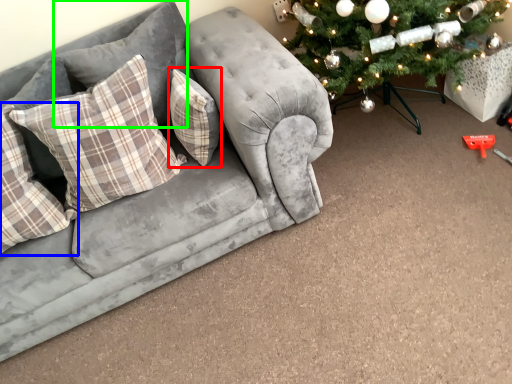
Question: Based on their relative distances, which object is farther from pillow (highlighted by a red box)? Choose from pillow (highlighted by a blue box) and pillow (highlighted by a green box).

Choices:
 (A) pillow
 (B) pillow

Answer: (A)